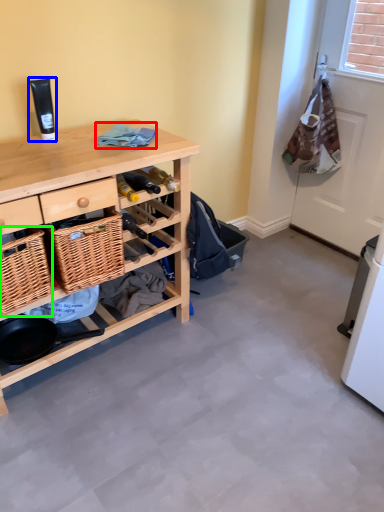
Question: Which object is positioned farthest from clothing (highlighted by a red box)? Select from toiletry (highlighted by a blue box) and picnic basket (highlighted by a green box).

Choices:
 (A) toiletry
 (B) picnic basket

Answer: (B)